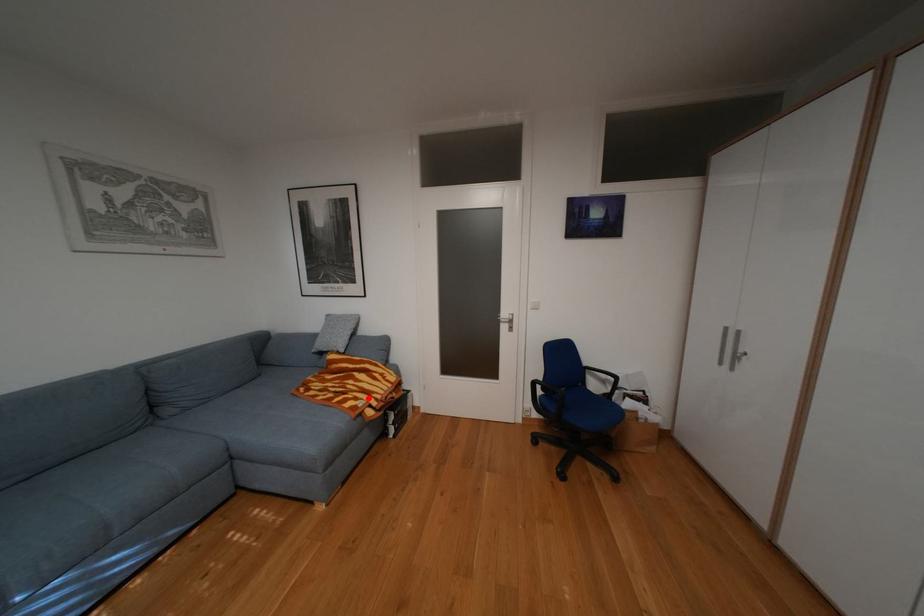
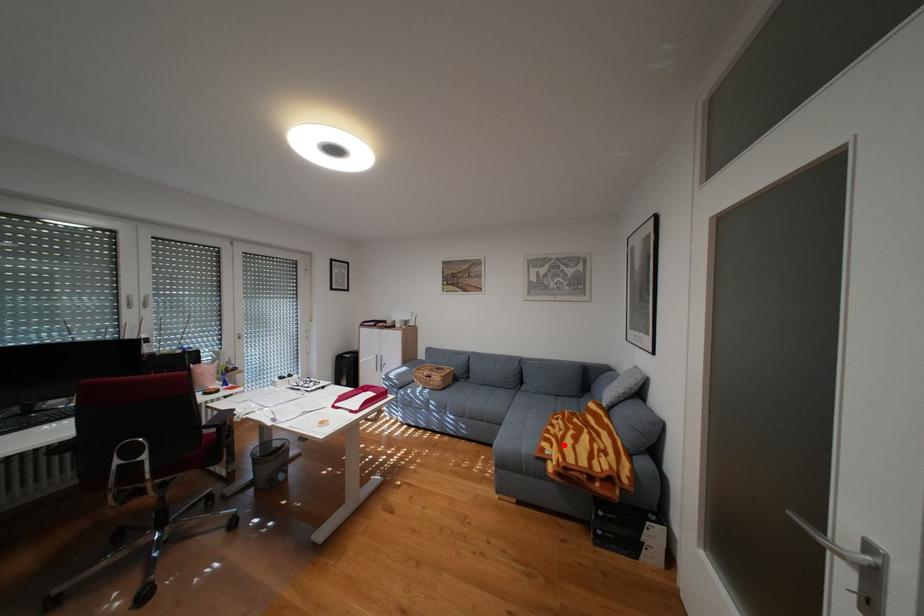
I am providing you with two images of the same scene from different viewpoints. A red point is marked on the first image and another point is marked on the second image. Is the red point in image1 aligned with the point shown in image2?

Yes